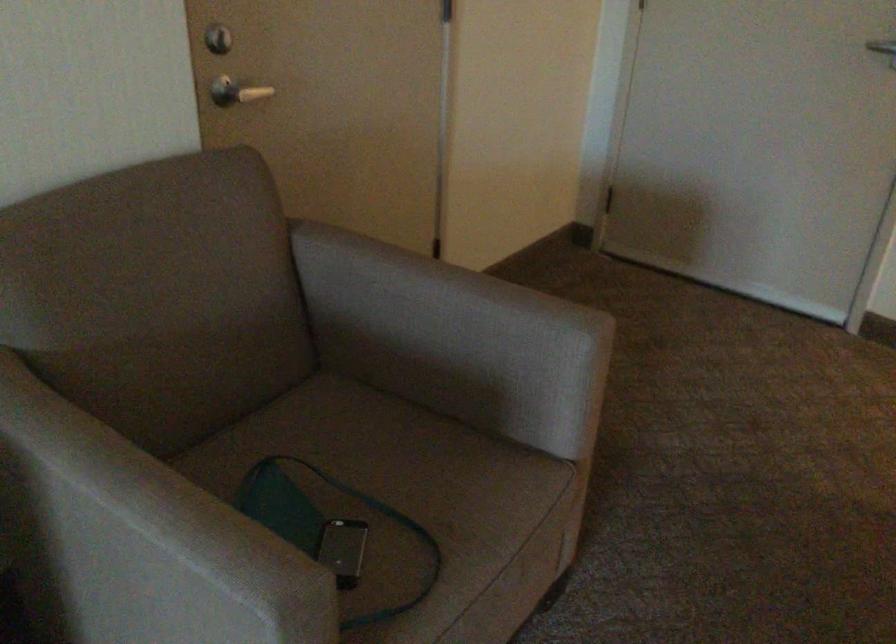
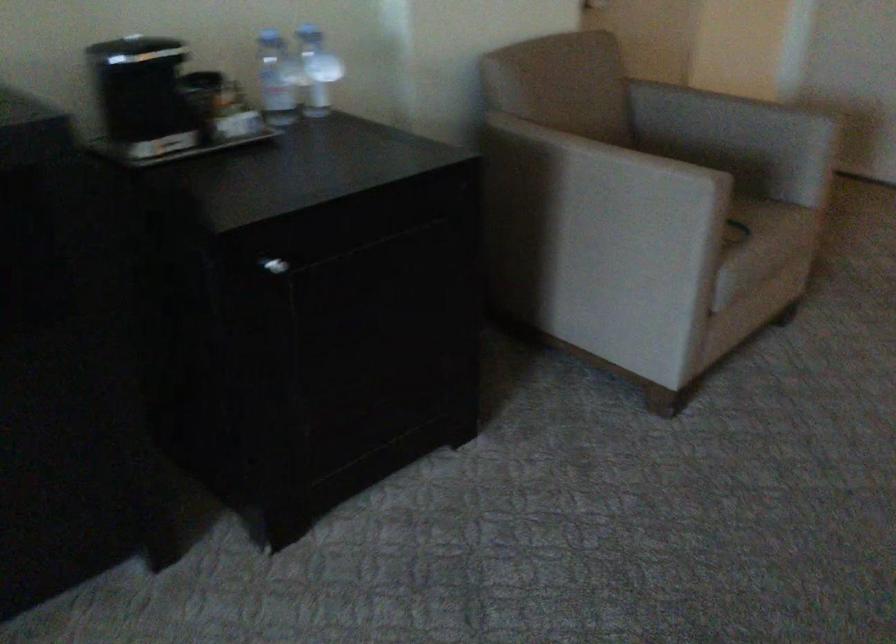
Which direction would the cameraman need to move to produce the second image?

The cameraman moved toward left, backward.